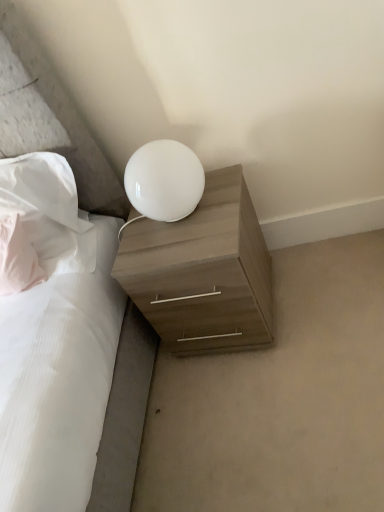
Question: Can you confirm if white fabric pillow at upper left, which appears as the 2th pillow when viewed from the left, is thinner than white glossy lamp at upper center?

Choices:
 (A) yes
 (B) no

Answer: (B)

Question: Can you confirm if white fabric pillow at upper left, which appears as the 2th pillow when viewed from the left, is shorter than white glossy lamp at upper center?

Choices:
 (A) no
 (B) yes

Answer: (A)

Question: Is white fabric pillow at upper left, arranged as the 1th pillow when viewed from the right, taller than white glossy lamp at upper center?

Choices:
 (A) yes
 (B) no

Answer: (A)

Question: From a real-world perspective, is white fabric pillow at upper left, which appears as the 2th pillow when viewed from the left, under white glossy lamp at upper center?

Choices:
 (A) no
 (B) yes

Answer: (A)

Question: Considering the relative sizes of white fabric pillow at upper left, arranged as the 1th pillow when viewed from the right, and white glossy lamp at upper center in the image provided, is white fabric pillow at upper left, arranged as the 1th pillow when viewed from the right, smaller than white glossy lamp at upper center?

Choices:
 (A) yes
 (B) no

Answer: (B)

Question: Is point (6, 224) closer or farther from the camera than point (165, 205)?

Choices:
 (A) closer
 (B) farther

Answer: (B)

Question: Is pink fabric pillow at left, acting as the second pillow starting from the right, wider or thinner than white glossy lamp at upper center?

Choices:
 (A) thin
 (B) wide

Answer: (A)

Question: Looking at the image, does pink fabric pillow at left, acting as the second pillow starting from the right, seem bigger or smaller compared to white glossy lamp at upper center?

Choices:
 (A) big
 (B) small

Answer: (B)

Question: Which is correct: pink fabric pillow at left, acting as the second pillow starting from the right, is inside white glossy lamp at upper center, or outside of it?

Choices:
 (A) inside
 (B) outside

Answer: (B)

Question: Is point click(157, 243) closer or farther from the camera than point click(34, 202)?

Choices:
 (A) closer
 (B) farther

Answer: (A)

Question: Relative to white fabric pillow at upper left, arranged as the 1th pillow when viewed from the right, is light wood/texture nightstand at lower right in front or behind?

Choices:
 (A) behind
 (B) front

Answer: (B)

Question: From the image's perspective, relative to white fabric pillow at upper left, arranged as the 1th pillow when viewed from the right, is light wood/texture nightstand at lower right above or below?

Choices:
 (A) above
 (B) below

Answer: (B)

Question: Considering the positions of light wood/texture nightstand at lower right and white fabric pillow at upper left, which appears as the 2th pillow when viewed from the left, in the image, is light wood/texture nightstand at lower right wider or thinner than white fabric pillow at upper left, which appears as the 2th pillow when viewed from the left,?

Choices:
 (A) thin
 (B) wide

Answer: (B)

Question: Based on their sizes in the image, would you say pink fabric pillow at left, acting as the second pillow starting from the right, is bigger or smaller than light wood/texture nightstand at lower right?

Choices:
 (A) big
 (B) small

Answer: (B)

Question: Considering the relative positions of pink fabric pillow at left, acting as the second pillow starting from the right, and light wood/texture nightstand at lower right in the image provided, is pink fabric pillow at left, acting as the second pillow starting from the right, to the left or to the right of light wood/texture nightstand at lower right?

Choices:
 (A) left
 (B) right

Answer: (A)